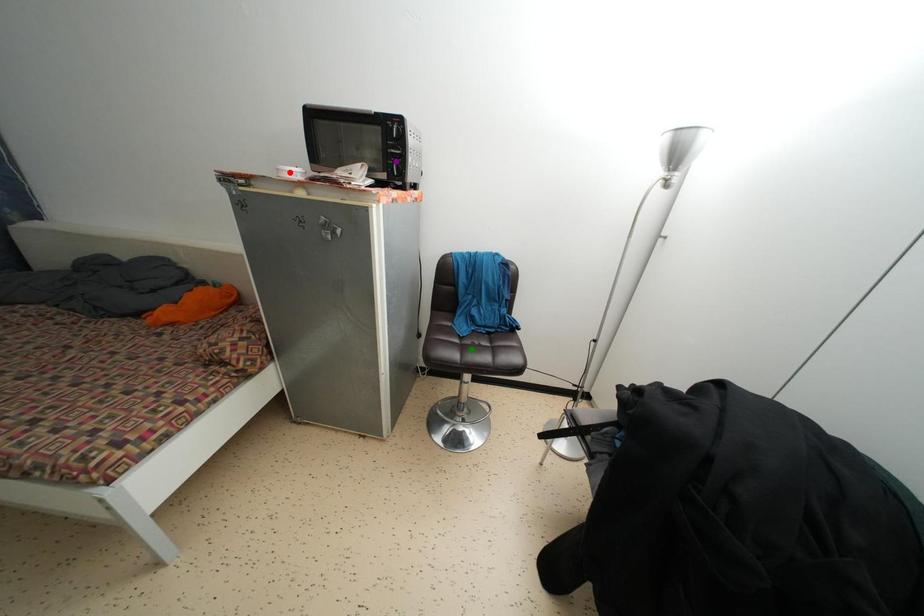
Order these from nearest to farthest:
green point | purple point | red point

red point, purple point, green point